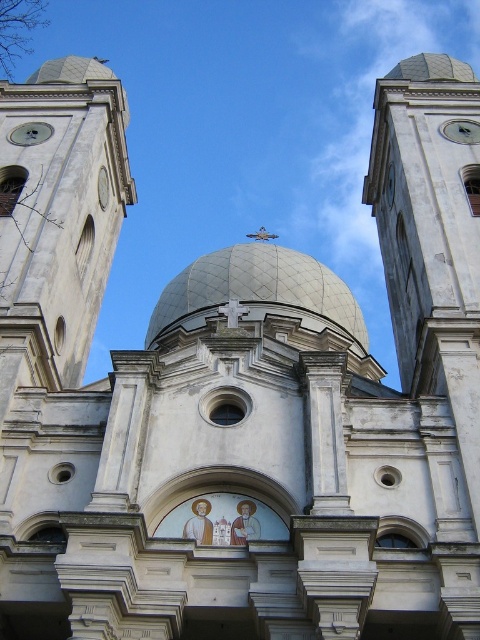
Question: Does white stone tower at upper right have a larger size compared to metallic clock at upper right?

Choices:
 (A) no
 (B) yes

Answer: (B)

Question: Estimate the real-world distances between objects in this image. Which object is closer to the metallic clock at upper right?

Choices:
 (A) white stone tower at upper right
 (B) white textured dome at center

Answer: (A)

Question: Estimate the real-world distances between objects in this image. Which object is farther from the white textured dome at center?

Choices:
 (A) metallic clock at upper right
 (B) white stone tower at upper right

Answer: (A)

Question: Observing the image, what is the correct spatial positioning of white textured dome at center in reference to metallic clock at upper right?

Choices:
 (A) right
 (B) left

Answer: (B)

Question: In this image, where is white stone tower at upper right located relative to metallic clock at upper right?

Choices:
 (A) above
 (B) below

Answer: (A)

Question: Estimate the real-world distances between objects in this image. Which object is closer to the metallic clock at upper right?

Choices:
 (A) white stone tower at upper right
 (B) white textured dome at center

Answer: (A)